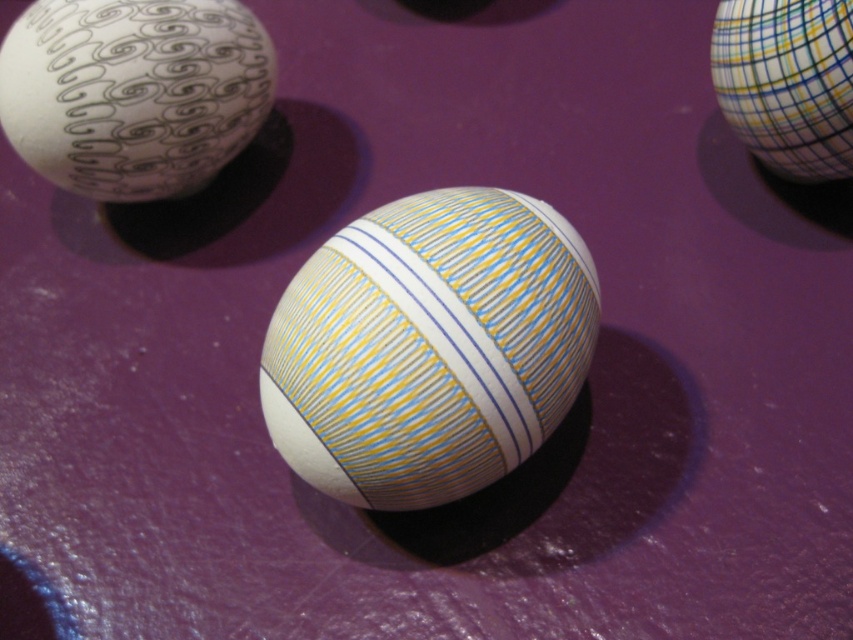
You are an art curator arranging an exhibition. You have two eggs to display on a narrow shelf that can only accommodate items up to 12 cm in width. The white matte egg at upper left and the multicolored striped egg at upper right are both candidates. Based on their widths, which egg should you choose to ensure it fits on the shelf?

The white matte egg at upper left might be wider than the multicolored striped egg at upper right. Since the shelf can only hold items up to 12 cm, it is safer to choose the multicolored striped egg at upper right to ensure it fits.

You are an egg collector who wants to place a new egg between the yellow striped egg at center and the multicolored striped egg at upper right. The new egg is 10 inches in diameter. Will there be enough space between the two existing eggs to fit the new one?

The distance between the yellow striped egg at center and the multicolored striped egg at upper right is 21.61 inches. Since the new egg has a diameter of 10 inches, there is sufficient space to place it between them as the distance is greater than the egg size.

In the scene shown: You are an artist examining the eggs displayed on the purple surface. You notice an egg at point (132, 92). What is the color and pattern of the egg located at that specific coordinate?

The egg at point (132, 92) is the white matte egg at upper left, which has a black and white design with swirling patterns resembling abstract organic forms.